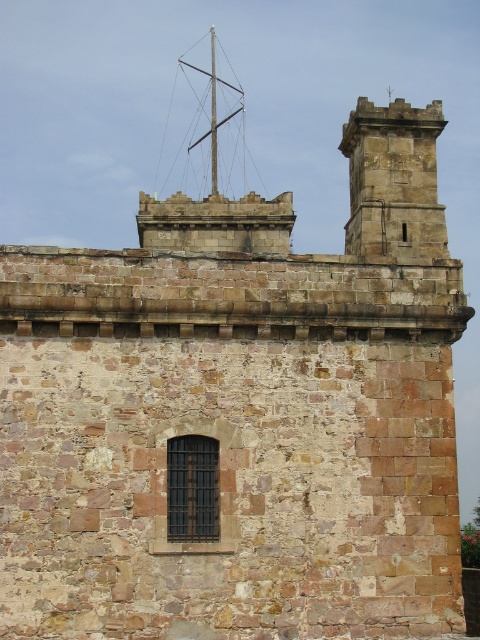
From the picture: You are standing in front of the historic stone building and notice two structures. The stone tower at upper right and the metallic silver mast at upper center. Which one is positioned higher up on the wall?

The metallic silver mast at upper center is positioned higher up on the wall than the stone tower at upper right because the stone tower at upper right is located below it.

You are an architect examining the historic stone building and notice the stone tower at upper right and the metallic silver mast at upper center. Which object is located to the right of the other?

The stone tower at upper right is positioned on the right side of the metallic silver mast at upper center, so the stone tower at upper right is located to the right of the metallic silver mast at upper center.